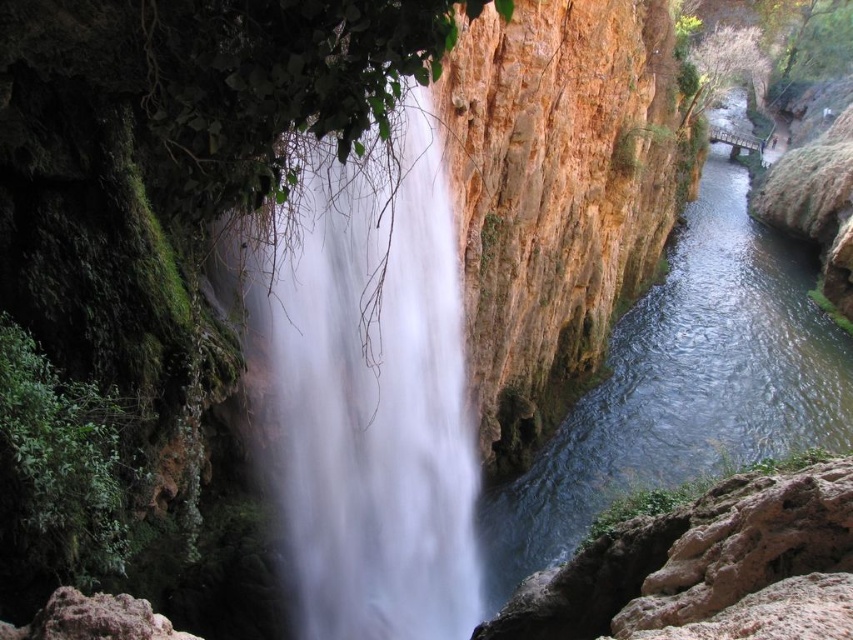
You are standing at point (741, 186) and want to reach the waterfall. The distance between you and the waterfall is 179.18 meters. If you walk directly towards the waterfall at a speed of 1.5 meters per second, how many seconds will it take you to reach the waterfall?

The distance between you and the waterfall is 179.18 meters. Walking at 1.5 meters per second, it will take 179.18 divided by 1.5, which equals approximately 119.45 seconds to reach the waterfall.

You are a photographer planning to capture the white smooth waterfall at center and the clear water at center right in a single shot. Based on the scene, which object will require more focus adjustments due to its size in the frame?

The clear water at center right will require more focus adjustments because it occupies more space in the frame than the white smooth waterfall at center, as stated in the objects description.